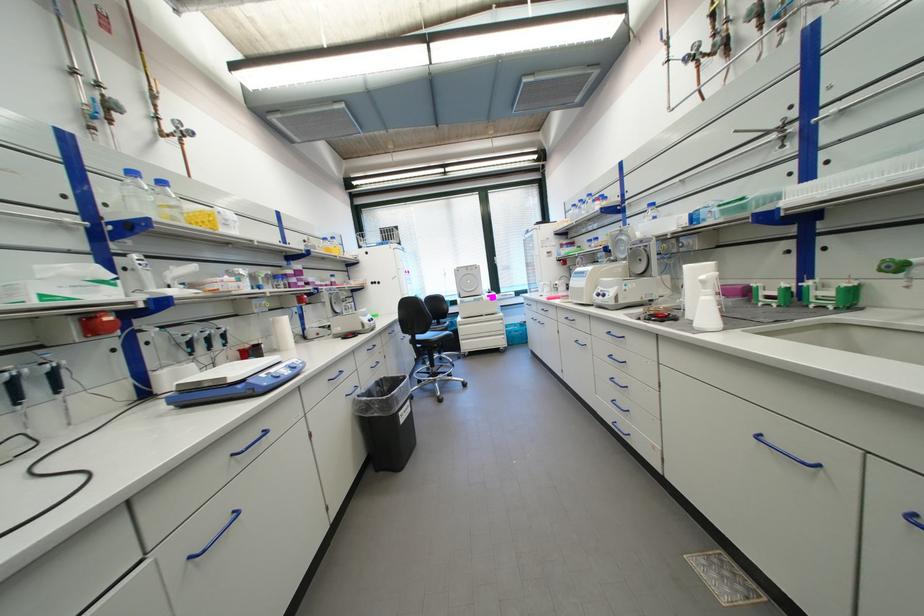
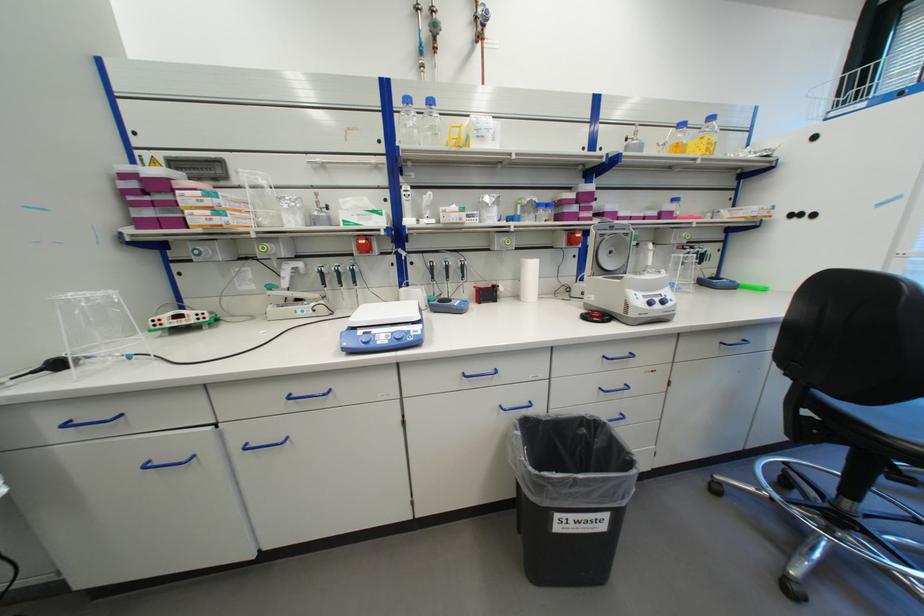
Find the pixel in the second image that matches (x=304, y=371) in the first image.

(405, 344)